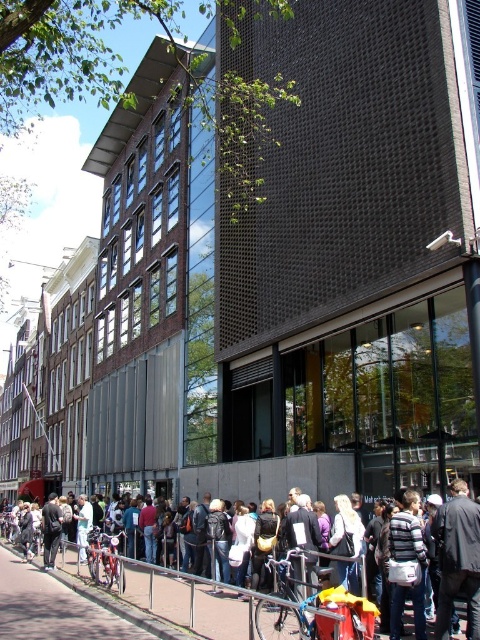
You are a photographer standing in front of the modern building. You want to take a photo of the white cotton shirt at center and the concrete pavement at lower center. Which object is located to the right of the other?

The white cotton shirt at center is positioned on the right side of concrete pavement at lower center.